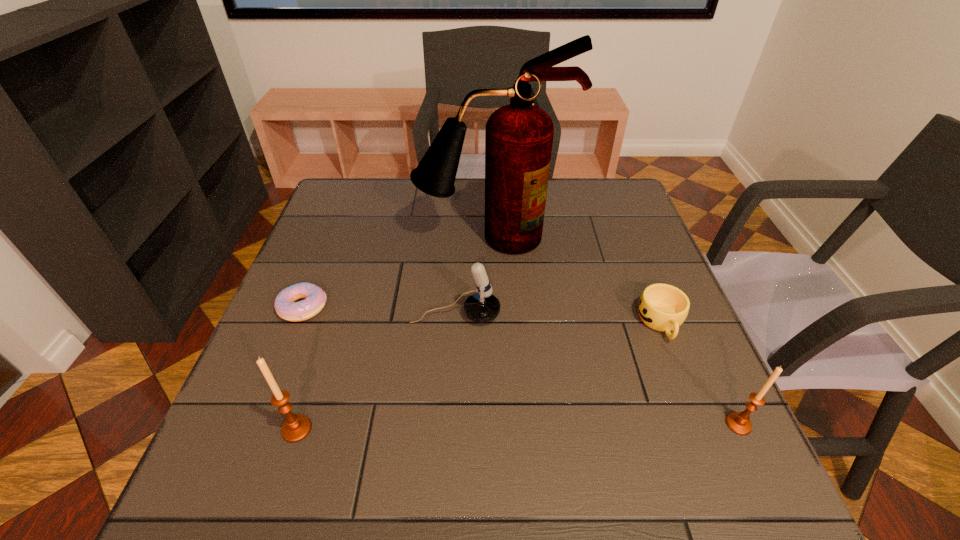
Where is `vacant point located between the microphone and the right candle_holder`? This screenshot has width=960, height=540. vacant point located between the microphone and the right candle_holder is located at coordinates (597, 369).

Identify the location of unoccupied position between the taller candle_holder and the fire extinguisher. Image resolution: width=960 pixels, height=540 pixels. (395, 333).

You are a GUI agent. You are given a task and a screenshot of the screen. Output one action in this format:
    pyautogui.click(x=<x>, y=<y>)
    Task: Click on the vacant point located between the right candle_holder and the farthest object
    Image resolution: width=960 pixels, height=540 pixels.
    Given the screenshot: What is the action you would take?
    pyautogui.click(x=615, y=331)

At what (x,y) coordinates should I click in order to perform the action: click on blank region between the cup and the left candle_holder. Please return your answer as a coordinate pair (x, y). This screenshot has width=960, height=540. Looking at the image, I should click on (479, 376).

At what (x,y) coordinates should I click in order to perform the action: click on free space between the taller candle_holder and the right candle_holder. Please return your answer as a coordinate pair (x, y). The image size is (960, 540). Looking at the image, I should click on (517, 427).

The image size is (960, 540). What are the coordinates of `vacant space that's between the farthest object and the shortest object` in the screenshot? It's located at (397, 273).

Find the location of a particular element. This screenshot has height=540, width=960. vacant space that's between the right candle_holder and the fifth tallest object is located at coordinates (700, 374).

Locate an element on the screen. Image resolution: width=960 pixels, height=540 pixels. free space between the cup and the microphone is located at coordinates [x=558, y=319].

What are the coordinates of `object that is the third closest to the shortest object` in the screenshot? It's located at (518, 137).

Choose which object is the nearest neighbor to the microphone. Please provide its 2D coordinates. Your answer should be formatted as a tuple, i.e. [(x, y)], where the tuple contains the x and y coordinates of a point satisfying the conditions above.

[(518, 137)]